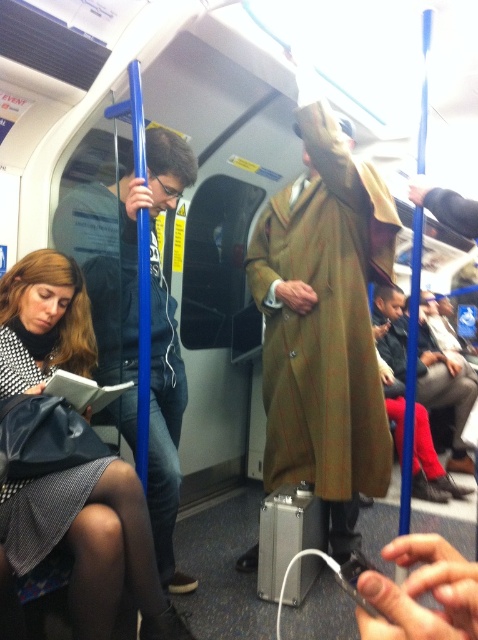
In the scene shown: You are a delivery robot with a package that needs to be placed between the matte black book at lower left and the green wool coat at center. The package requires a minimum of 10 feet of space. Can you fit it there?

The distance between the matte black book at lower left and the green wool coat at center is 9.58 feet, which is less than the required 10 feet. Therefore, the package cannot be placed there.

You are a passenger in the subway carriage and want to know which point is closer to you. The points are point (344,452) and point (13,269). Which one is closer?

Point (13,269) is closer to you because it is less further than point (344,452).

You are a passenger in the subway carriage and want to take a photo of both the seated person and the standing person. Which of the two points, point (272,342) or point (430,337), should you focus on to ensure both subjects are in clear view?

You should focus on point (272,342) because it is closer to the camera than point (430,337), ensuring both subjects are in focus.